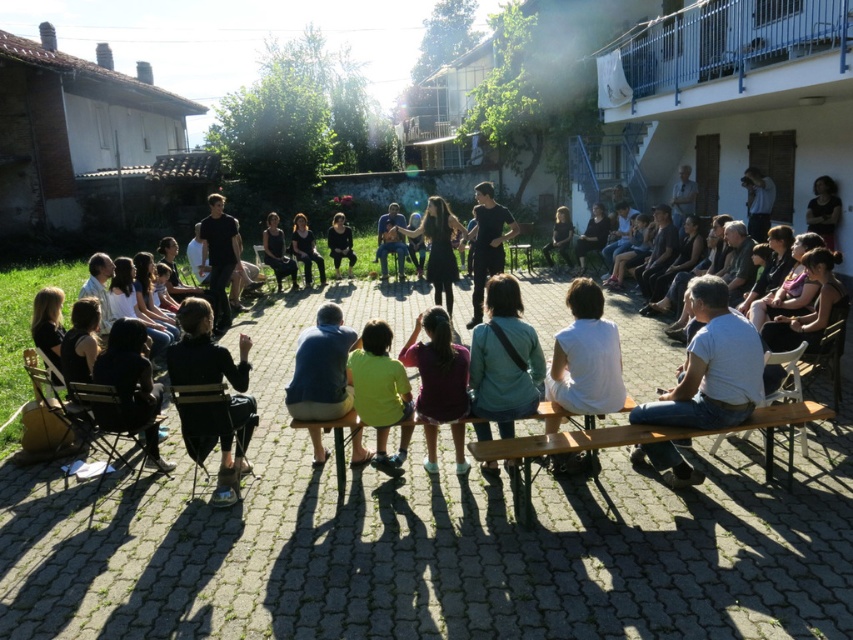
You are a photographer trying to capture a group photo of the wooden park bench at center and the matte purple shirt at center. Since you want to ensure both subjects are in focus, you need to know their relative heights. Which one is taller?

The wooden park bench at center is not as tall as matte purple shirt at center, so the matte purple shirt at center is taller.

You are a photographer trying to capture a group photo of the wooden park bench at center and the green matte shirt at center. Which object should you focus on first if you want to ensure both are in focus, considering their heights?

The wooden park bench at center is not as tall as the green matte shirt at center, so you should focus on the green matte shirt at center first to ensure both are in focus.

You are a photographer standing at the edge of the courtyard. You want to take a photo that includes both the matte purple shirt at center and the green matte shirt at center. What is the minimum distance you need to move forward to ensure both shirts are in frame?

The matte purple shirt at center and green matte shirt at center are 9.83 inches apart from each other. To ensure both are in frame, you need to move forward until the camera can capture a field of view that accommodates this distance. However, without knowing the camera specifications, an exact distance cannot be determined.